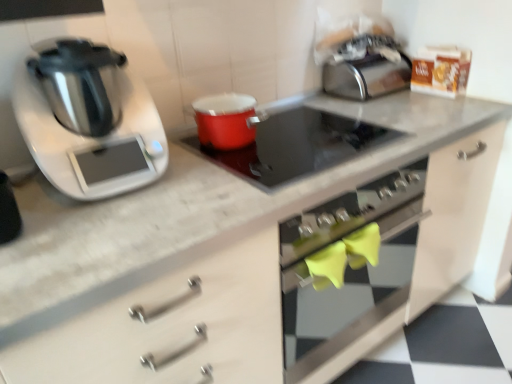
Where is `free space in front of shiny metallic pressure cooker at left`? This screenshot has width=512, height=384. free space in front of shiny metallic pressure cooker at left is located at coordinates pos(100,230).